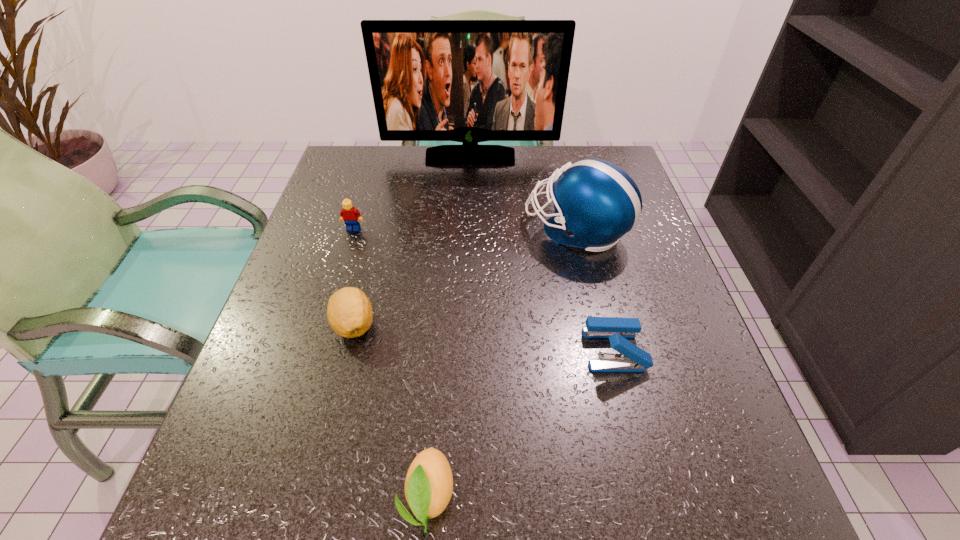
What are the coordinates of `free location at the far edge` in the screenshot? It's located at (540, 158).

Find the location of a particular element. The height and width of the screenshot is (540, 960). free space at the left edge of the desktop is located at coordinates (314, 266).

In the image, there is a desktop. Where is `vacant area at the right edge`? This screenshot has height=540, width=960. vacant area at the right edge is located at coordinates (731, 432).

Image resolution: width=960 pixels, height=540 pixels. Identify the location of vacant space that is in between the Lego and the stapler. (484, 289).

Image resolution: width=960 pixels, height=540 pixels. Find the location of `free space between the second tallest object and the stapler`. free space between the second tallest object and the stapler is located at coordinates (595, 289).

Locate an element on the screen. This screenshot has width=960, height=540. vacant region between the farthest object and the football helmet is located at coordinates (523, 193).

The width and height of the screenshot is (960, 540). Find the location of `free space that is in between the farther lemon and the monitor`. free space that is in between the farther lemon and the monitor is located at coordinates pos(412,241).

Locate an element on the screen. vacant region between the football helmet and the monitor is located at coordinates (523, 193).

You are a GUI agent. You are given a task and a screenshot of the screen. Output one action in this format:
    pyautogui.click(x=<x>, y=<y>)
    Task: Click on the vacant point located between the left lemon and the football helmet
    The image size is (960, 540).
    Given the screenshot: What is the action you would take?
    pyautogui.click(x=466, y=277)

Locate an element on the screen. The width and height of the screenshot is (960, 540). free area in between the left lemon and the monitor is located at coordinates (412, 241).